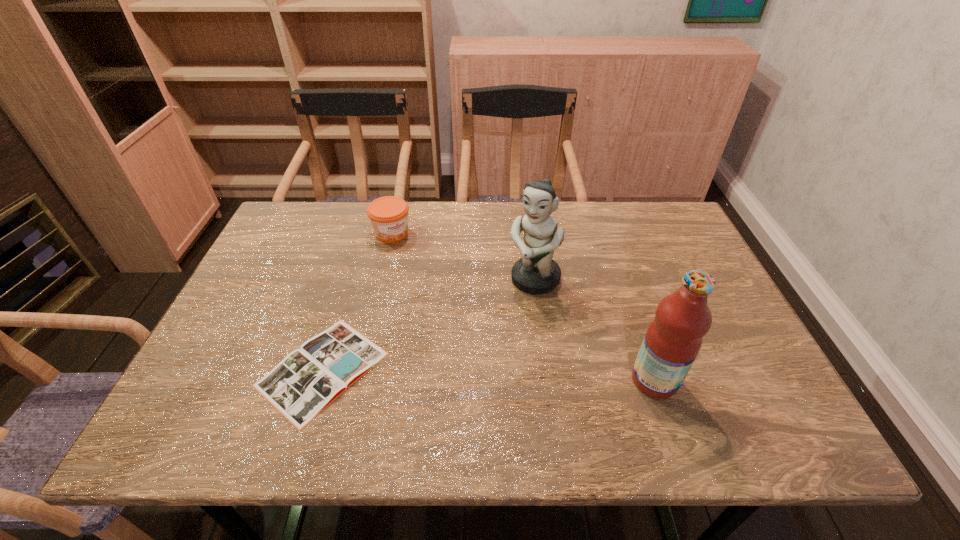
Locate an element on the screen. vacant space on the desktop that is between the shortest object and the rightmost object and is positioned on the front-facing side of the second farthest object is located at coordinates (463, 374).

Where is `free spot on the desktop that is between the book and the rightmost object and is positioned on the front label of the farthest object`? The height and width of the screenshot is (540, 960). free spot on the desktop that is between the book and the rightmost object and is positioned on the front label of the farthest object is located at coordinates (531, 376).